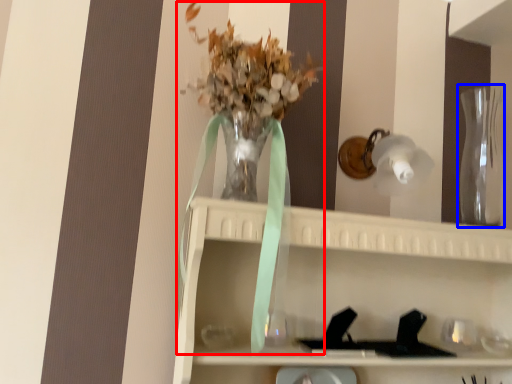
Question: Which of the following is the farthest to the observer, floral arrangement (highlighted by a red box) or glass vase (highlighted by a blue box)?

Choices:
 (A) floral arrangement
 (B) glass vase

Answer: (B)